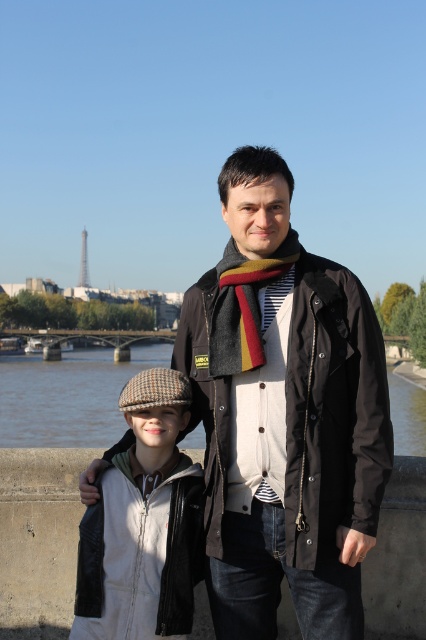
You are a photographer trying to capture a photo of both individuals in the scene. You notice two points marked on your camera screen at coordinates point (221, 282) and point (80, 250). To ensure both subjects are in focus, you need to adjust your camera focus. Which point should you focus on first to capture the person closer to the camera?

You should focus on point (80, 250) first because point (221, 282) is in front of point (80, 250), meaning the person at point (80, 250) is closer to the camera and needs to be in focus first.

You are a photographer trying to capture a closeup of the striped wool scarf at center without including the black matte jacket at center in the frame. Is this possible given their positions?

The black matte jacket at center is positioned under the striped wool scarf at center, so it is possible to capture a closeup of the striped wool scarf at center without including the jacket by framing the shot to exclude the lower area where the jacket is located.

You are a photographer standing at the riverbank and want to take a photo of the herringbone wool cap at center and the striped wool scarf at center. If your camera can only focus on objects within 5 meters, will both items be in focus?

The herringbone wool cap at center is 5.81 meters from the striped wool scarf at center. Since the distance between them is greater than 5 meters, the camera cannot focus on both items simultaneously.